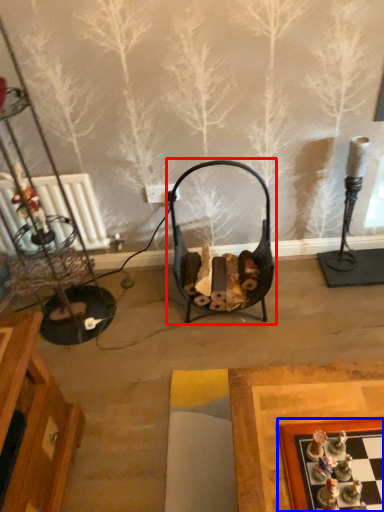
Question: Which object appears closest to the camera in this image, swivel chair (highlighted by a red box) or board game (highlighted by a blue box)?

Choices:
 (A) swivel chair
 (B) board game

Answer: (B)